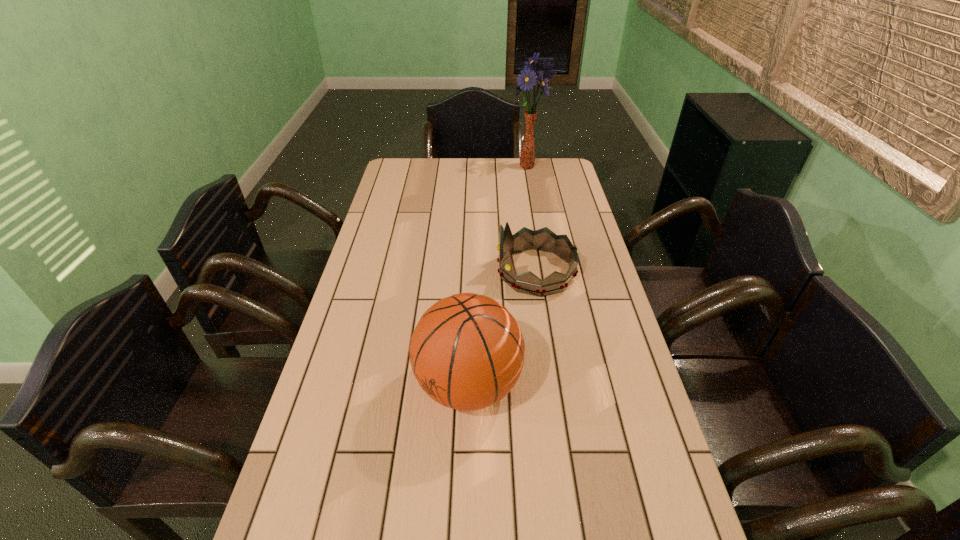
Identify the location of empty space that is in between the second tallest object and the tallest object. The image size is (960, 540). (497, 276).

At what (x,y) coordinates should I click in order to perform the action: click on empty location between the second shortest object and the flower arrangement. Please return your answer as a coordinate pair (x, y). This screenshot has height=540, width=960. Looking at the image, I should click on (497, 276).

At what (x,y) coordinates should I click in order to perform the action: click on vacant area that lies between the flower arrangement and the second nearest object. Please return your answer as a coordinate pair (x, y). The height and width of the screenshot is (540, 960). Looking at the image, I should click on (531, 219).

Identify which object is located as the nearest to the basketball. Please provide its 2D coordinates. Your answer should be formatted as a tuple, i.e. [(x, y)], where the tuple contains the x and y coordinates of a point satisfying the conditions above.

[(544, 239)]

Locate an element on the screen. object that is the second nearest to the basketball is located at coordinates (540, 71).

You are a GUI agent. You are given a task and a screenshot of the screen. Output one action in this format:
    pyautogui.click(x=<x>, y=<y>)
    Task: Click on the vacant space that satisfies the following two spatial constraints: 1. on the back side of the tallest object; 2. on the right side of the basketball
    The height and width of the screenshot is (540, 960).
    Given the screenshot: What is the action you would take?
    pyautogui.click(x=473, y=167)